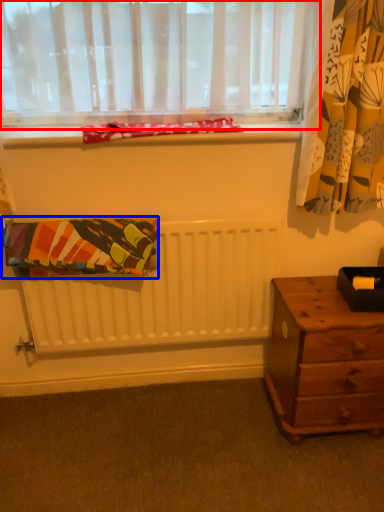
Question: Which object is closer to the camera taking this photo, window (highlighted by a red box) or blanket (highlighted by a blue box)?

Choices:
 (A) window
 (B) blanket

Answer: (A)